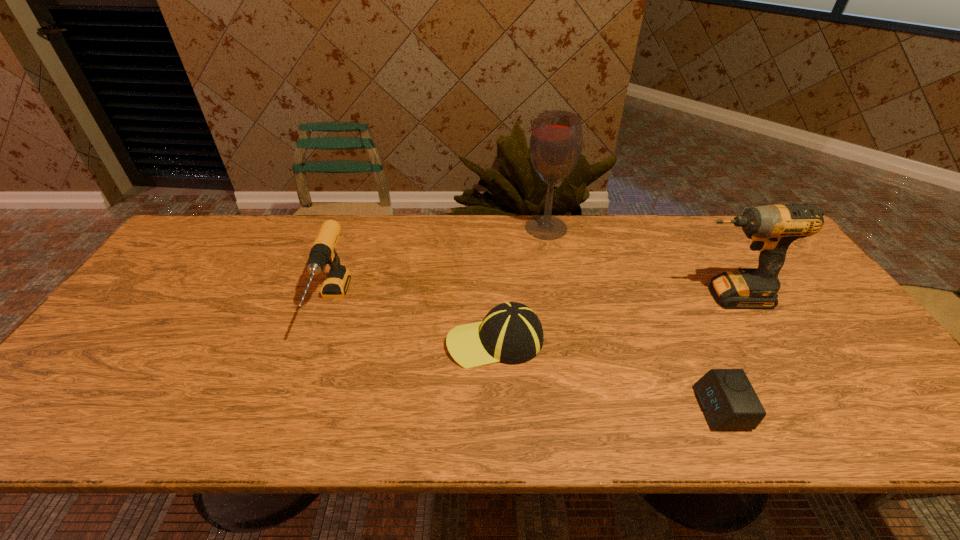
I want to click on vacant space that's between the left drill and the second shortest object, so click(414, 322).

Locate an element on the screen. empty space between the taller drill and the tallest object is located at coordinates (636, 262).

This screenshot has height=540, width=960. I want to click on empty space between the alcohol and the baseball cap, so click(x=520, y=284).

At what (x,y) coordinates should I click in order to perform the action: click on vacant region between the right drill and the left drill. Please return your answer as a coordinate pair (x, y). The image size is (960, 540). Looking at the image, I should click on (530, 300).

The image size is (960, 540). Identify the location of empty space that is in between the second tallest object and the shorter drill. (530, 300).

Locate an element on the screen. This screenshot has height=540, width=960. vacant area that lies between the left drill and the right drill is located at coordinates (530, 300).

The image size is (960, 540). Identify the location of free space between the fourth shortest object and the second shortest object. (612, 319).

Find the location of `empty location between the right drill and the nearest object`. empty location between the right drill and the nearest object is located at coordinates (724, 353).

Locate an element on the screen. This screenshot has height=540, width=960. the third closest object to the alcohol is located at coordinates (336, 283).

Identify which object is located as the third nearest to the third shortest object. Please provide its 2D coordinates. Your answer should be formatted as a tuple, i.e. [(x, y)], where the tuple contains the x and y coordinates of a point satisfying the conditions above.

[(729, 402)]